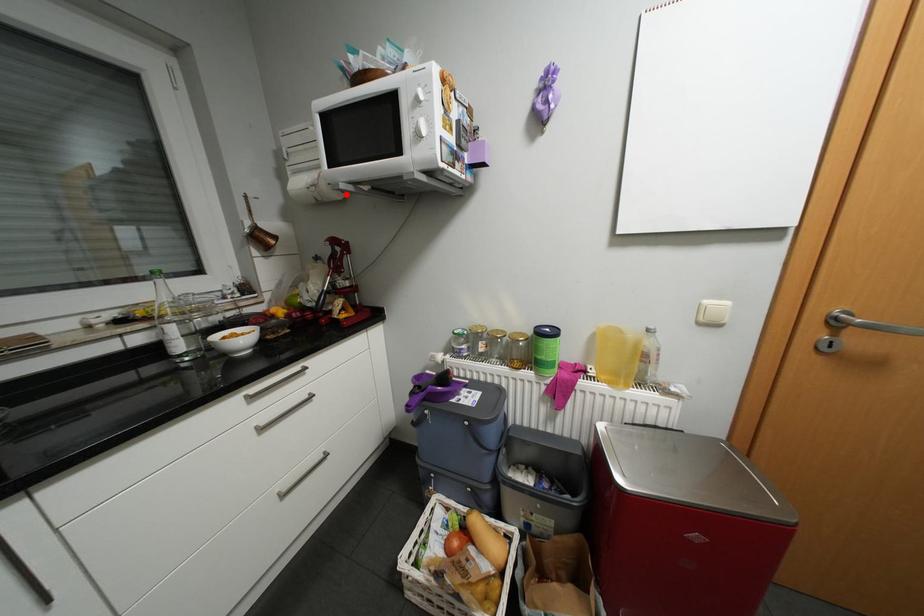
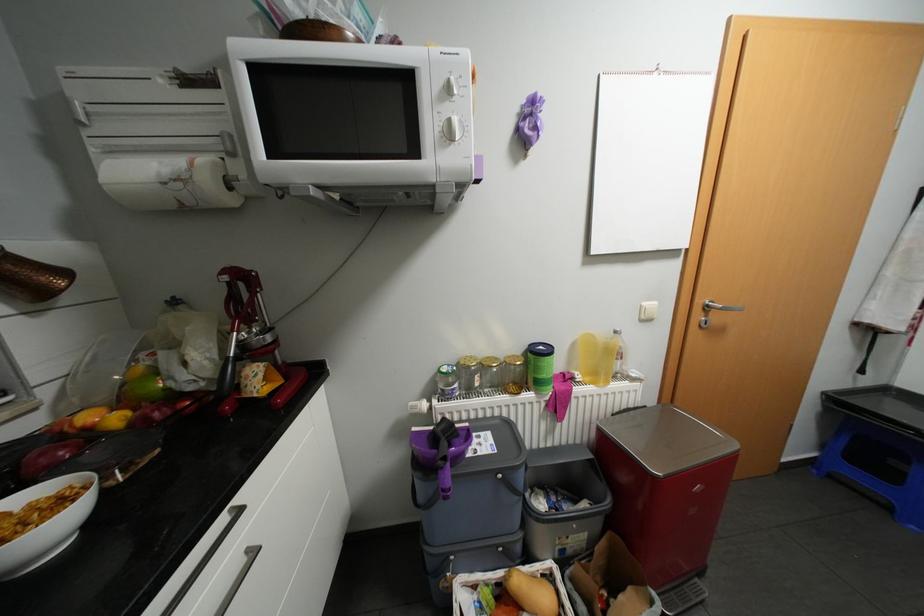
In the second image, find the point that corresponds to the highlighted location in the first image.

(239, 199)